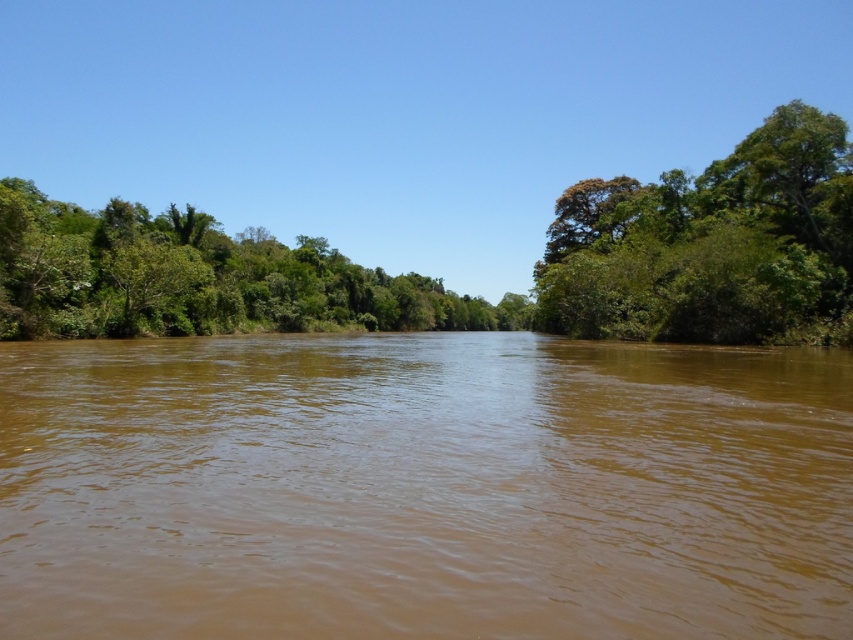
Question: Does brown muddy water at center appear on the right side of green leafy trees at left?

Choices:
 (A) no
 (B) yes

Answer: (B)

Question: Is brown muddy water at center positioned before green leafy tree at right?

Choices:
 (A) no
 (B) yes

Answer: (B)

Question: Which is nearer to the green leafy trees at left?

Choices:
 (A) brown muddy water at center
 (B) green leafy tree at right

Answer: (B)

Question: Which point is closer to the camera taking this photo?

Choices:
 (A) (32, 632)
 (B) (740, 237)

Answer: (A)

Question: Is the position of brown muddy water at center more distant than that of green leafy tree at right?

Choices:
 (A) yes
 (B) no

Answer: (B)

Question: Which point is farther to the camera?

Choices:
 (A) green leafy trees at left
 (B) green leafy tree at right

Answer: (A)